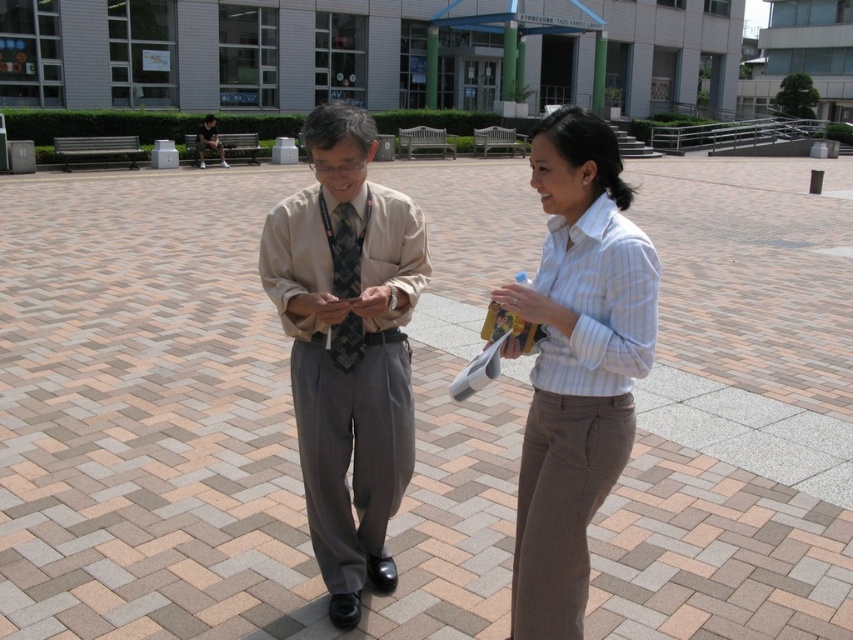
Question: Among these objects, which one is nearest to the camera?

Choices:
 (A) dark gray textured tie at center
 (B) striped cotton shirt at center

Answer: (B)

Question: Can you confirm if light brown fabric shirt at center is thinner than striped cotton shirt at center?

Choices:
 (A) no
 (B) yes

Answer: (A)

Question: Does light brown fabric shirt at center have a greater width compared to striped cotton shirt at center?

Choices:
 (A) yes
 (B) no

Answer: (A)

Question: Can you confirm if light brown fabric shirt at center is wider than matte beige shirt at center?

Choices:
 (A) no
 (B) yes

Answer: (A)

Question: Which point appears closest to the camera in this image?

Choices:
 (A) (405, 452)
 (B) (573, 433)
 (C) (335, 252)

Answer: (B)

Question: Which is nearer to the dark gray textured tie at center?

Choices:
 (A) matte beige shirt at center
 (B) light brown fabric shirt at center

Answer: (A)